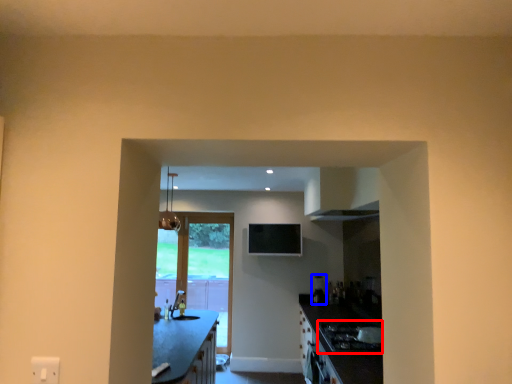
Question: Which point is closer to the camera, gas stove (highlighted by a red box) or appliance (highlighted by a blue box)?

Choices:
 (A) gas stove
 (B) appliance

Answer: (A)